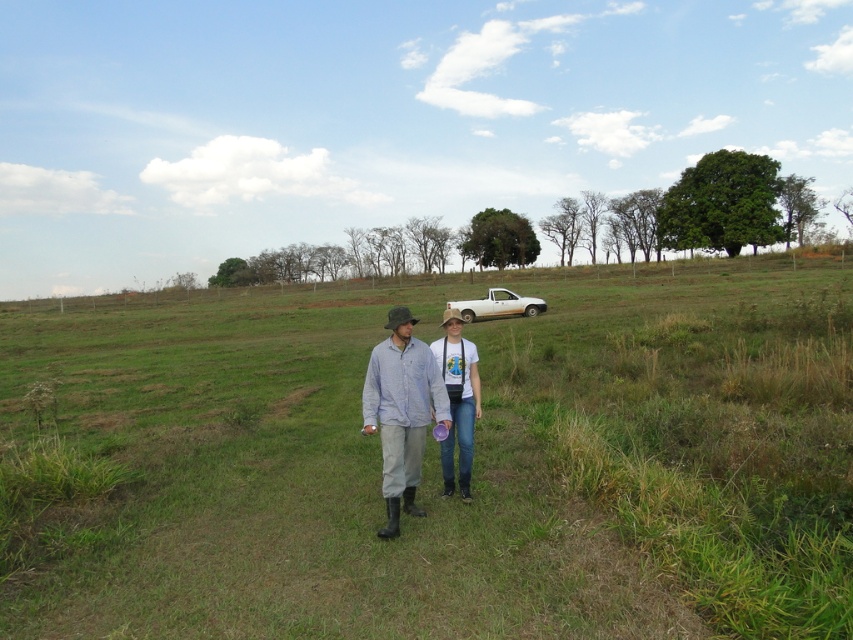
You are standing at the point labeled as point (x=438, y=461) in the image. What is the terrain like at that location?

The terrain at point (x=438, y=461) is green grass at center.